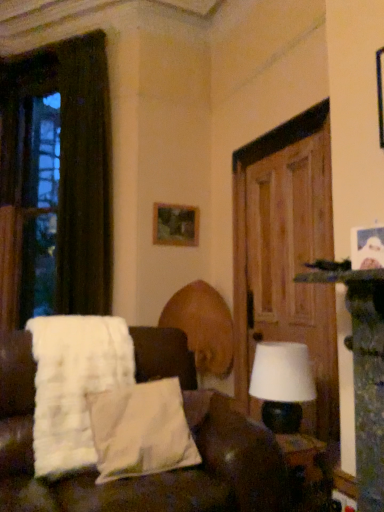
Question: Can you confirm if wooden picture frame at upper center is wider than white fabric couch at center?

Choices:
 (A) yes
 (B) no

Answer: (B)

Question: From a real-world perspective, is wooden picture frame at upper center physically below white fabric couch at center?

Choices:
 (A) no
 (B) yes

Answer: (A)

Question: From the image's perspective, is wooden picture frame at upper center over white fabric couch at center?

Choices:
 (A) no
 (B) yes

Answer: (B)

Question: Can you confirm if wooden picture frame at upper center is smaller than white fabric couch at center?

Choices:
 (A) no
 (B) yes

Answer: (B)

Question: Is wooden picture frame at upper center positioned far away from white fabric couch at center?

Choices:
 (A) no
 (B) yes

Answer: (B)

Question: Can we say wooden picture frame at upper center lies outside white fabric couch at center?

Choices:
 (A) yes
 (B) no

Answer: (A)

Question: From a real-world perspective, is white fluffy blanket at left on top of white fabric couch at center?

Choices:
 (A) yes
 (B) no

Answer: (A)

Question: Can you confirm if white fluffy blanket at left is thinner than white fabric couch at center?

Choices:
 (A) yes
 (B) no

Answer: (A)

Question: Could you tell me if white fluffy blanket at left is facing white fabric couch at center?

Choices:
 (A) yes
 (B) no

Answer: (A)

Question: From the image's perspective, is white fluffy blanket at left located beneath white fabric couch at center?

Choices:
 (A) yes
 (B) no

Answer: (B)

Question: Does white fluffy blanket at left have a larger size compared to white fabric couch at center?

Choices:
 (A) yes
 (B) no

Answer: (B)

Question: Considering the relative sizes of white fluffy blanket at left and white fabric couch at center in the image provided, is white fluffy blanket at left shorter than white fabric couch at center?

Choices:
 (A) yes
 (B) no

Answer: (A)

Question: Can you confirm if dark brown fabric curtain at left is thinner than wooden door at right?

Choices:
 (A) no
 (B) yes

Answer: (A)